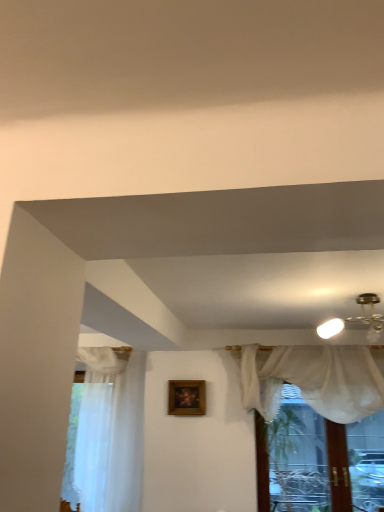
Question: Should I look upward or downward to see sheer white curtain at left?

Choices:
 (A) down
 (B) up

Answer: (A)

Question: From a real-world perspective, is sheer white curtain at left under sheer white curtain at upper center?

Choices:
 (A) yes
 (B) no

Answer: (A)

Question: Does sheer white curtain at left turn towards sheer white curtain at upper center?

Choices:
 (A) no
 (B) yes

Answer: (A)

Question: Considering the relative sizes of sheer white curtain at left and sheer white curtain at upper center in the image provided, is sheer white curtain at left bigger than sheer white curtain at upper center?

Choices:
 (A) yes
 (B) no

Answer: (B)

Question: Does sheer white curtain at left have a greater height compared to sheer white curtain at upper center?

Choices:
 (A) no
 (B) yes

Answer: (B)

Question: Is sheer white curtain at left next to sheer white curtain at upper center and touching it?

Choices:
 (A) no
 (B) yes

Answer: (A)

Question: Does sheer white curtain at left appear on the left side of sheer white curtain at upper center?

Choices:
 (A) no
 (B) yes

Answer: (B)

Question: Is sheer white curtain at upper center to the left of wooden frame at center from the viewer's perspective?

Choices:
 (A) no
 (B) yes

Answer: (A)

Question: Is sheer white curtain at upper center outside wooden frame at center?

Choices:
 (A) yes
 (B) no

Answer: (A)

Question: Is sheer white curtain at upper center oriented towards wooden frame at center?

Choices:
 (A) no
 (B) yes

Answer: (A)

Question: Is wooden frame at center a part of sheer white curtain at upper center?

Choices:
 (A) yes
 (B) no

Answer: (B)

Question: Is sheer white curtain at upper center to the right of wooden frame at center from the viewer's perspective?

Choices:
 (A) yes
 (B) no

Answer: (A)

Question: From a real-world perspective, is sheer white curtain at upper center under wooden frame at center?

Choices:
 (A) no
 (B) yes

Answer: (B)

Question: Can sheer white curtain at upper center be found inside wooden frame at center?

Choices:
 (A) yes
 (B) no

Answer: (B)